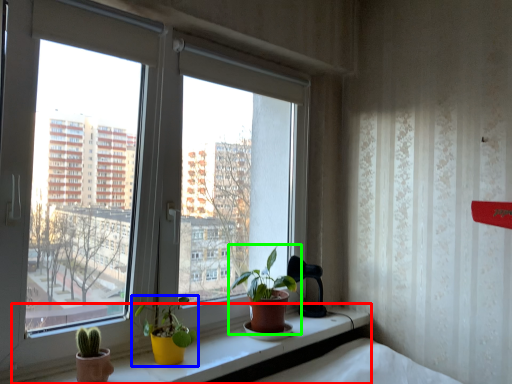
Question: Considering the real-world distances, which object is closest to window sill (highlighted by a red box)? houseplant (highlighted by a blue box) or houseplant (highlighted by a green box).

Choices:
 (A) houseplant
 (B) houseplant

Answer: (A)